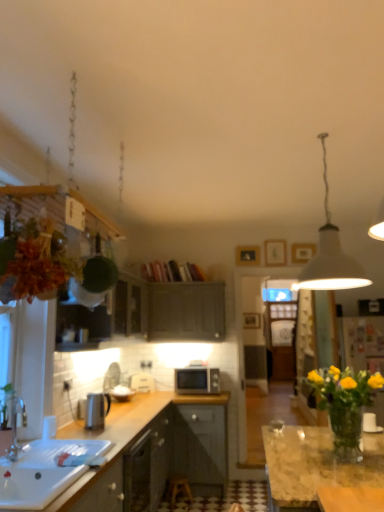
Question: From a real-world perspective, is wooden stool at center positioned under metallic silver kettle at left based on gravity?

Choices:
 (A) yes
 (B) no

Answer: (A)

Question: Does wooden stool at center appear on the right side of metallic silver kettle at left?

Choices:
 (A) yes
 (B) no

Answer: (A)

Question: Does wooden stool at center have a lesser height compared to metallic silver kettle at left?

Choices:
 (A) yes
 (B) no

Answer: (A)

Question: From the image's perspective, does wooden stool at center appear lower than metallic silver kettle at left?

Choices:
 (A) no
 (B) yes

Answer: (B)

Question: Considering the relative sizes of wooden stool at center and metallic silver kettle at left in the image provided, is wooden stool at center thinner than metallic silver kettle at left?

Choices:
 (A) yes
 (B) no

Answer: (B)

Question: From the image's perspective, is metallic silver kettle at left located above or below brushed metal faucet at left?

Choices:
 (A) below
 (B) above

Answer: (A)

Question: In terms of size, does metallic silver kettle at left appear bigger or smaller than brushed metal faucet at left?

Choices:
 (A) big
 (B) small

Answer: (B)

Question: Considering the positions of metallic silver kettle at left and brushed metal faucet at left in the image, is metallic silver kettle at left taller or shorter than brushed metal faucet at left?

Choices:
 (A) short
 (B) tall

Answer: (A)

Question: Considering their positions, is metallic silver kettle at left located in front of or behind brushed metal faucet at left?

Choices:
 (A) front
 (B) behind

Answer: (B)

Question: Is white matte pendant lamp at upper right situated inside matte gray cabinet at center, positioned as the first cabinetry in right-to-left order, or outside?

Choices:
 (A) inside
 (B) outside

Answer: (B)

Question: Is point (327, 203) closer or farther from the camera than point (185, 297)?

Choices:
 (A) farther
 (B) closer

Answer: (B)

Question: From a real-world perspective, is white matte pendant lamp at upper right physically located above or below matte gray cabinet at center, marked as the 2th cabinetry in a front-to-back arrangement?

Choices:
 (A) below
 (B) above

Answer: (B)

Question: Is white matte pendant lamp at upper right in front of or behind matte gray cabinet at center, the second cabinetry in the left-to-right sequence, in the image?

Choices:
 (A) front
 (B) behind

Answer: (A)

Question: From the image's perspective, is wooden stool at center located above or below metallic silver kettle at left?

Choices:
 (A) below
 (B) above

Answer: (A)

Question: Is wooden stool at center bigger or smaller than metallic silver kettle at left?

Choices:
 (A) big
 (B) small

Answer: (A)